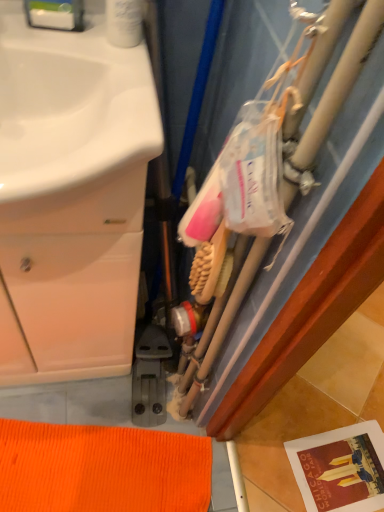
Question: From their relative heights in the image, would you say wooden-bristled brush at center-right is taller or shorter than white matte cabinet at left?

Choices:
 (A) short
 (B) tall

Answer: (A)

Question: Does point (203, 243) appear closer or farther from the camera than point (135, 69)?

Choices:
 (A) closer
 (B) farther

Answer: (B)

Question: Is wooden-bristled brush at center-right inside or outside of white matte cabinet at left?

Choices:
 (A) outside
 (B) inside

Answer: (A)

Question: Is white matte cabinet at left bigger or smaller than wooden-bristled brush at center-right?

Choices:
 (A) small
 (B) big

Answer: (B)

Question: In the image, is white matte cabinet at left on the left side or the right side of wooden-bristled brush at center-right?

Choices:
 (A) left
 (B) right

Answer: (A)

Question: From a real-world perspective, relative to wooden-bristled brush at center-right, is white matte cabinet at left vertically above or below?

Choices:
 (A) above
 (B) below

Answer: (B)

Question: In terms of height, does white matte cabinet at left look taller or shorter compared to wooden-bristled brush at center-right?

Choices:
 (A) tall
 (B) short

Answer: (A)